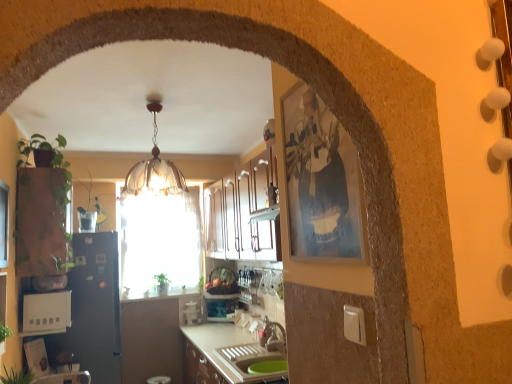
Question: From their relative heights in the image, would you say green leafy plant at center, which appears as the third plant when viewed from the top, is taller or shorter than metallic silver toaster at center, the 1th appliance when ordered from right to left?

Choices:
 (A) tall
 (B) short

Answer: (A)

Question: Which is correct: green leafy plant at center, the third plant positioned from the left, is inside metallic silver toaster at center, the 1th appliance when ordered from right to left, or outside of it?

Choices:
 (A) outside
 (B) inside

Answer: (A)

Question: Which is farther from the white glossy countertop at center?

Choices:
 (A) black matte refrigerator at left, placed as the 2th appliance when sorted from front to back
 (B) wooden picture frame at right
 (C) green matte plant at left, which is counted as the third plant, starting from the right
 (D) metallic silver toaster at center, the first appliance when ordered from back to front
 (E) white glossy cabinets at center

Answer: (B)

Question: Estimate the real-world distances between objects in this image. Which object is closer to the metallic silver toaster at center, the third appliance when ordered from left to right?

Choices:
 (A) white glossy counter top at center
 (B) black matte refrigerator at left, the 2th appliance viewed from the left
 (C) wooden picture frame at right
 (D) white plastic toaster at lower left, the 1th appliance from the left
 (E) green leafy plant at center, which is the 1th plant in bottom-to-top order

Answer: (A)